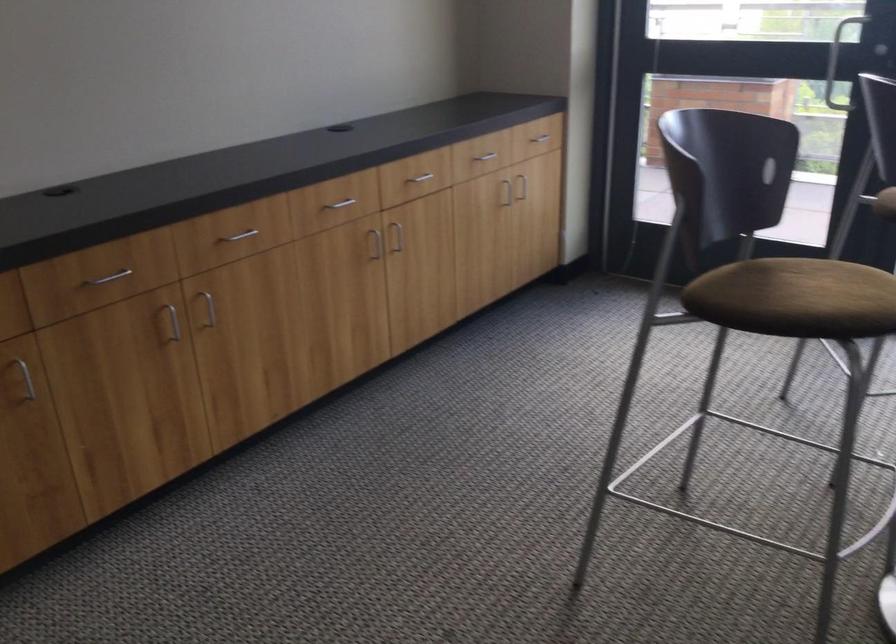
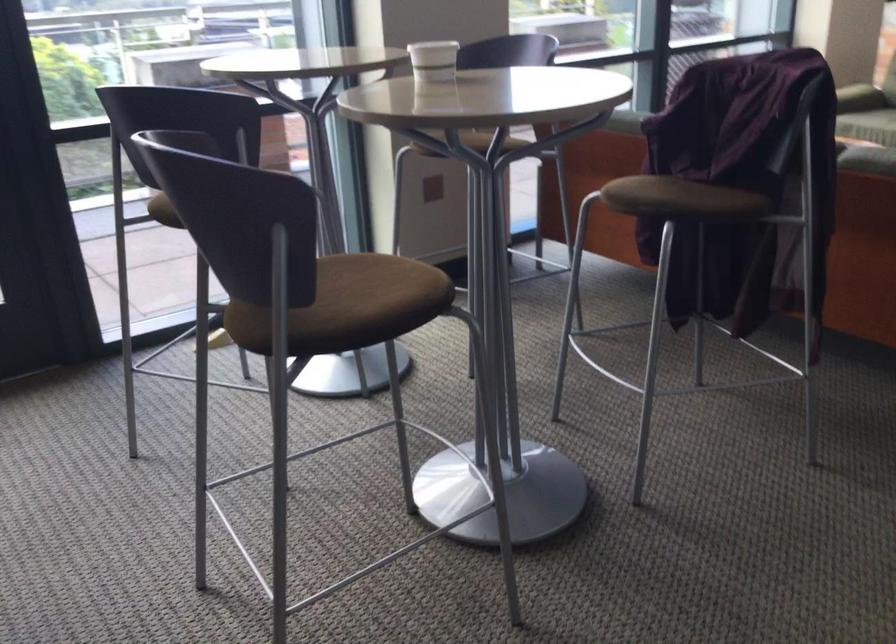
Locate, in the second image, the point that corresponds to [802,297] in the first image.

(371, 292)